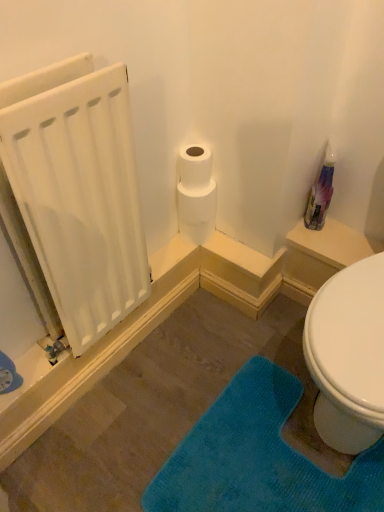
Question: Should I look upward or downward to see translucent plastic spray bottle at upper right?

Choices:
 (A) down
 (B) up

Answer: (B)

Question: Is white matte toilet paper at upper center next to teal plush bath mat at lower right?

Choices:
 (A) no
 (B) yes

Answer: (A)

Question: Does white matte toilet paper at upper center turn towards teal plush bath mat at lower right?

Choices:
 (A) yes
 (B) no

Answer: (B)

Question: Is white matte toilet paper at upper center turned away from teal plush bath mat at lower right?

Choices:
 (A) yes
 (B) no

Answer: (B)

Question: From the image's perspective, does white matte toilet paper at upper center appear higher than teal plush bath mat at lower right?

Choices:
 (A) no
 (B) yes

Answer: (B)

Question: Is white matte toilet paper at upper center taller than teal plush bath mat at lower right?

Choices:
 (A) no
 (B) yes

Answer: (B)

Question: Is white matte toilet paper at upper center at the left side of teal plush bath mat at lower right?

Choices:
 (A) yes
 (B) no

Answer: (A)

Question: Can you confirm if translucent plastic spray bottle at upper right is positioned to the left of white matte radiator at left?

Choices:
 (A) yes
 (B) no

Answer: (B)

Question: Does translucent plastic spray bottle at upper right touch white matte radiator at left?

Choices:
 (A) no
 (B) yes

Answer: (A)

Question: Is translucent plastic spray bottle at upper right far away from white matte radiator at left?

Choices:
 (A) yes
 (B) no

Answer: (B)

Question: From a real-world perspective, is translucent plastic spray bottle at upper right below white matte radiator at left?

Choices:
 (A) yes
 (B) no

Answer: (A)

Question: From a real-world perspective, is translucent plastic spray bottle at upper right physically above white matte radiator at left?

Choices:
 (A) yes
 (B) no

Answer: (B)

Question: Could you tell me if translucent plastic spray bottle at upper right is facing white matte radiator at left?

Choices:
 (A) no
 (B) yes

Answer: (A)

Question: Is white matte radiator at left not within translucent plastic spray bottle at upper right?

Choices:
 (A) yes
 (B) no

Answer: (A)